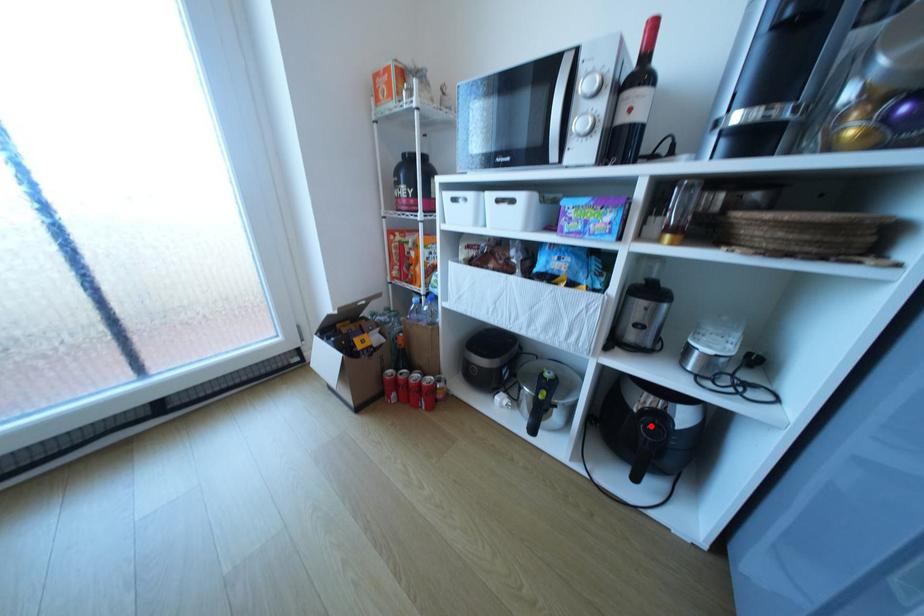
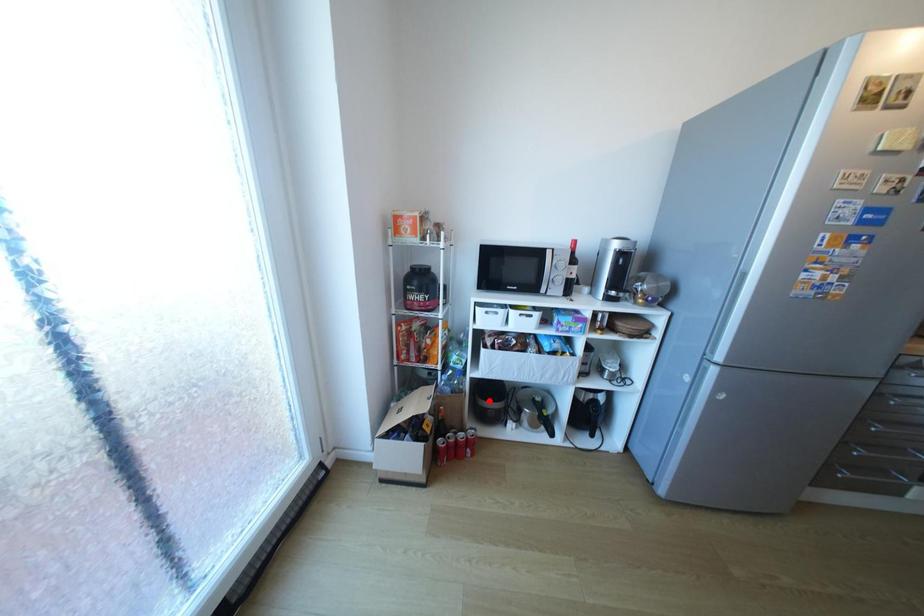
I am providing you with two images of the same scene from different viewpoints. A red point is marked on the first image and another point is marked on the second image. Is the marked point in image1 the same physical position as the marked point in image2?

No